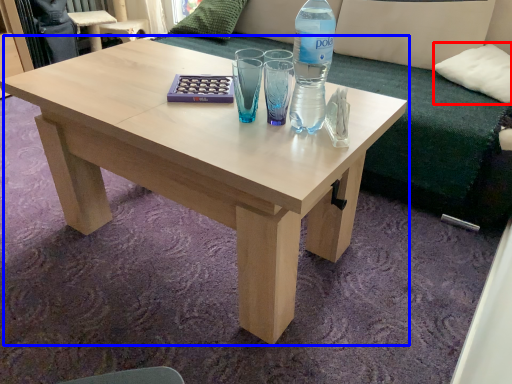
Question: Which of the following is the closest to the observer, pillow (highlighted by a red box) or coffee table (highlighted by a blue box)?

Choices:
 (A) pillow
 (B) coffee table

Answer: (B)